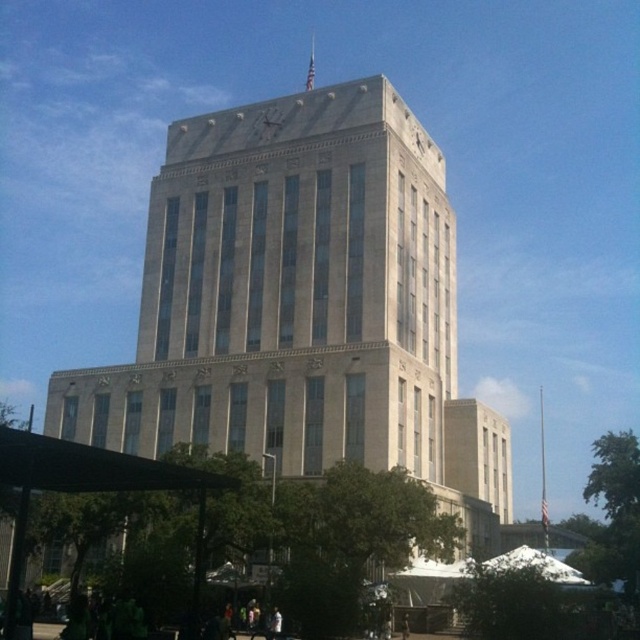
Which is more to the left, beige stone tower at center or white fabric canopy at lower center?

beige stone tower at center is more to the left.

From the picture: Can you confirm if beige stone tower at center is positioned below white fabric canopy at lower center?

No.

Locate an element on the screen. This screenshot has height=640, width=640. beige stone tower at center is located at coordinates (301, 307).

Locate an element on the screen. This screenshot has height=640, width=640. beige stone tower at center is located at coordinates (301, 307).